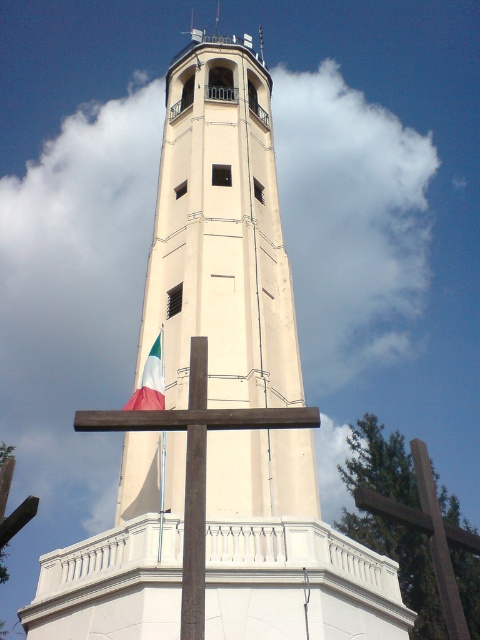
Which is below, brown wooden cross at center or white fabric flag at center?

Positioned lower is brown wooden cross at center.

Is brown wooden cross at center smaller than white fabric flag at center?

No, brown wooden cross at center is not smaller than white fabric flag at center.

Who is more forward, (x=203, y=451) or (x=146, y=380)?

Point (x=203, y=451)

What are the coordinates of `brown wooden cross at center` in the screenshot? It's located at (195, 461).